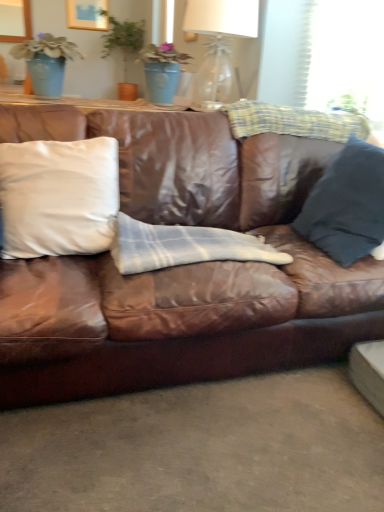
Question: From the image's perspective, relative to white matte pillow at left, which is the 1th pillow from left to right, is white plaid blanket at center above or below?

Choices:
 (A) above
 (B) below

Answer: (B)

Question: Does point [x=145, y=233] appear closer or farther from the camera than point [x=84, y=248]?

Choices:
 (A) farther
 (B) closer

Answer: (A)

Question: Which of these objects is positioned closest to the matte blue pot at upper left?

Choices:
 (A) white plaid blanket at center
 (B) dark blue fabric pillow at right, the first pillow in the right-to-left sequence
 (C) white matte pillow at left, which appears as the 2th pillow when viewed from the right
 (D) translucent glass table lamp at upper center
 (E) brown leather couch at center

Answer: (C)

Question: Estimate the real-world distances between objects in this image. Which object is farther from the white matte pillow at left, which is the 1th pillow from left to right?

Choices:
 (A) brown leather couch at center
 (B) translucent glass table lamp at upper center
 (C) matte blue pot at upper left
 (D) dark blue fabric pillow at right, which is the second pillow in left-to-right order
 (E) white plaid blanket at center

Answer: (B)